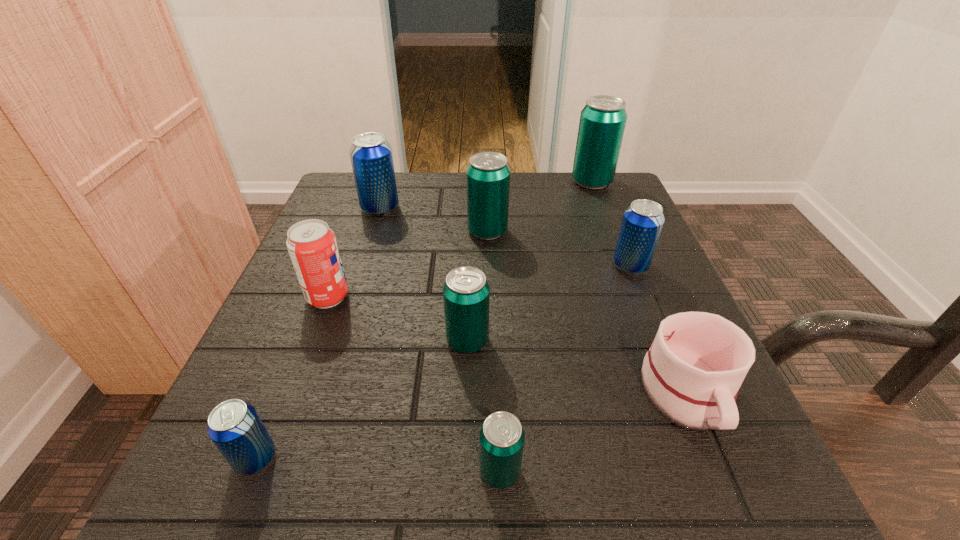
You are a GUI agent. You are given a task and a screenshot of the screen. Output one action in this format:
    pyautogui.click(x=<x>, y=<y>)
    Task: Click on the beer can that stands as the fourth closest to the second farthest beer can
    This screenshot has height=540, width=960.
    Given the screenshot: What is the action you would take?
    pyautogui.click(x=642, y=223)

The width and height of the screenshot is (960, 540). In order to click on teal beer can that is the second closest to the second biggest teal beer can in this screenshot , I will do `click(466, 293)`.

Locate which teal beer can ranks in proximity to the biggest teal beer can. Please provide its 2D coordinates. Your answer should be formatted as a tuple, i.e. [(x, y)], where the tuple contains the x and y coordinates of a point satisfying the conditions above.

[(488, 175)]

This screenshot has height=540, width=960. Identify the location of the third closest blue beer can to the third farthest object. (234, 426).

Identify the location of the third closest blue beer can to the third farthest beer can. This screenshot has height=540, width=960. (234, 426).

Identify the location of vacant point that satisfies the following two spatial constraints: 1. on the back side of the third nearest teal beer can; 2. on the right side of the third nearest beer can. Image resolution: width=960 pixels, height=540 pixels. (470, 232).

Image resolution: width=960 pixels, height=540 pixels. What are the coordinates of `free point that satisfies the following two spatial constraints: 1. on the back side of the nearest blue beer can; 2. on the right side of the biggest blue beer can` in the screenshot? It's located at (354, 208).